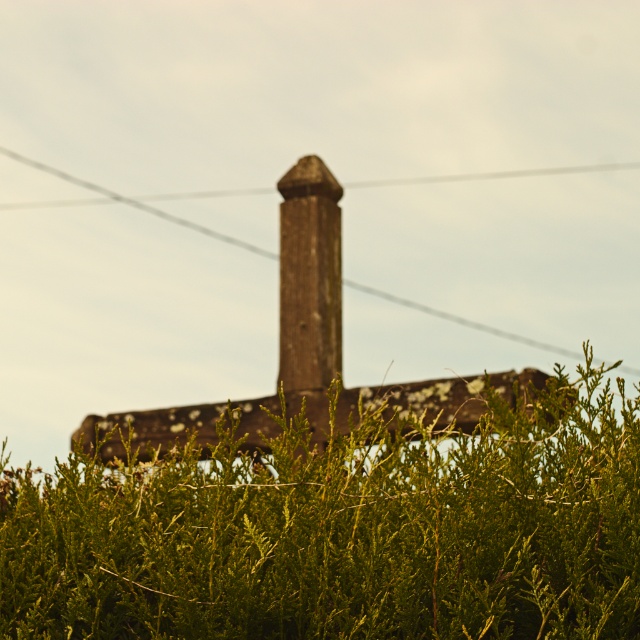
You are standing in front of the stone structure and want to place a small garden gnome exactly at the center of the green leafy hedge at center. According to the image, what are the coordinates where you should place the gnome?

The coordinates for the green leafy hedge at center are at point (342, 531), so you should place the gnome at those coordinates.

You are standing in front of the stone structure and want to touch both the green leafy hedge at center and the brown stone pillar at center. Which object should you reach for first to touch the one closer to you?

You should reach for the green leafy hedge at center first because it is closer to the viewer than the brown stone pillar at center.

You are standing in front of the stone structure and notice two points marked on the image. The first point is at coordinates point (74,596) and the second is at point (314,161). Which point is closer to you?

Point (74,596) is in front of point (314,161), so it is closer to you.